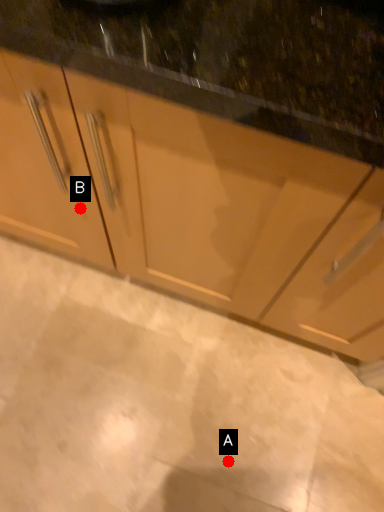
Question: Two points are circled on the image, labeled by A and B beside each circle. Which point is farther to the camera?

Choices:
 (A) A is further
 (B) B is further

Answer: (A)